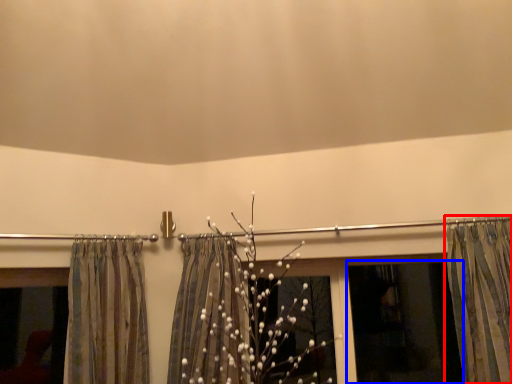
Question: Which object is closer to the camera taking this photo, curtain (highlighted by a red box) or window screen (highlighted by a blue box)?

Choices:
 (A) curtain
 (B) window screen

Answer: (A)